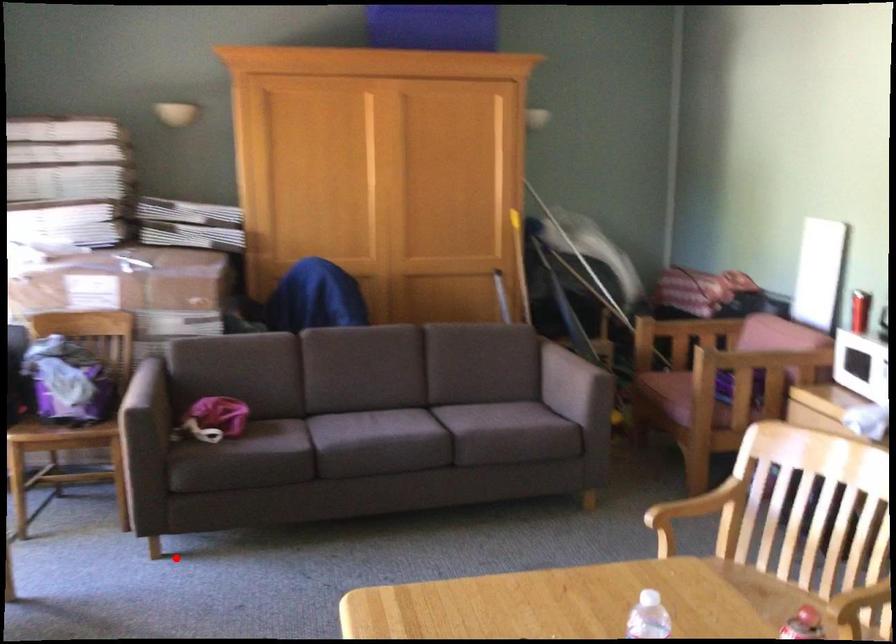
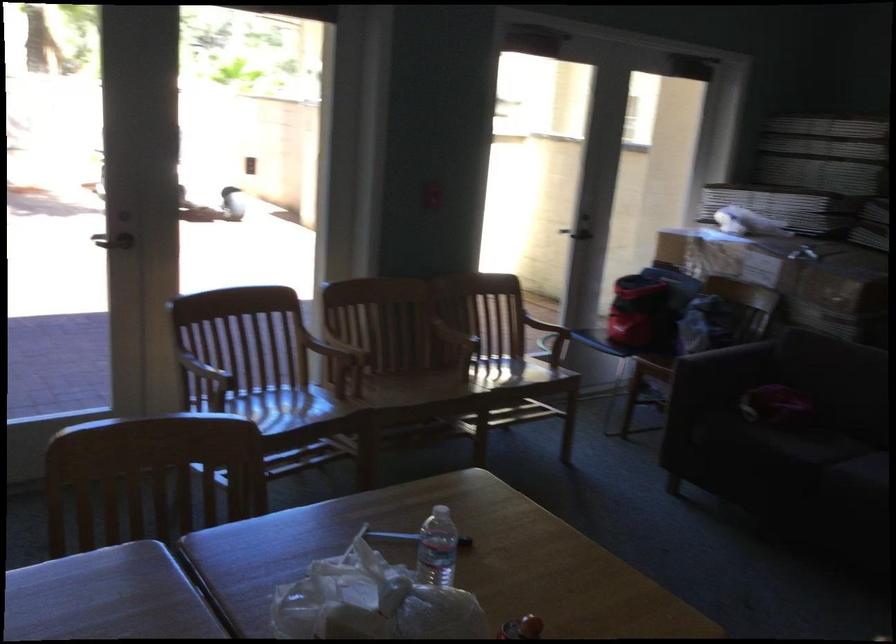
Locate, in the second image, the point that corresponds to the highlighted location in the first image.

(673, 488)